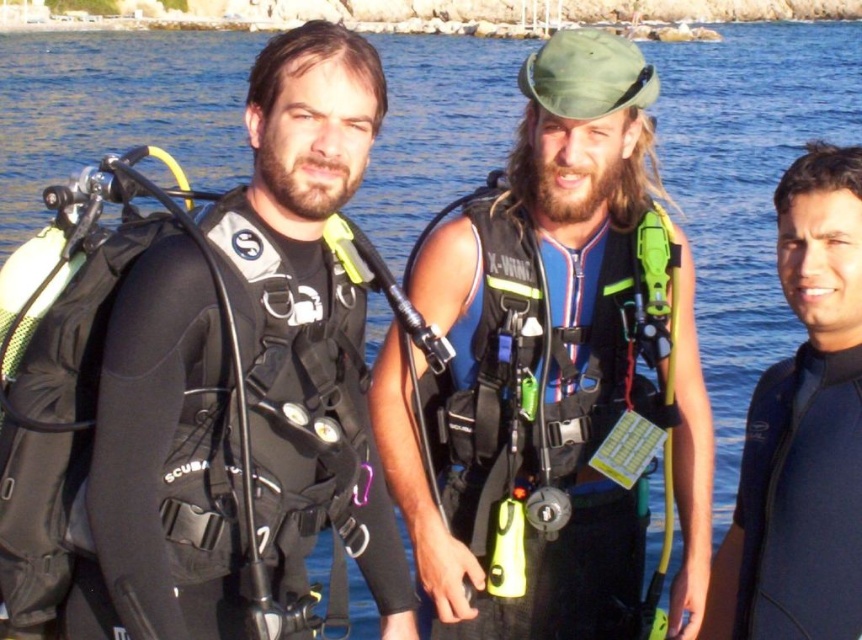
Who is positioned more to the right, matte black wetsuit at center or black matte wetsuit at left?

From the viewer's perspective, matte black wetsuit at center appears more on the right side.

Between matte black wetsuit at center and black matte wetsuit at left, which one has more height?

matte black wetsuit at center

Image resolution: width=862 pixels, height=640 pixels. What do you see at coordinates (551, 369) in the screenshot?
I see `matte black wetsuit at center` at bounding box center [551, 369].

Where is `matte black wetsuit at center`? This screenshot has width=862, height=640. matte black wetsuit at center is located at coordinates (551, 369).

Is point (292, 413) positioned before point (813, 292)?

Yes, it is.

Is black matte wetsuit at left thinner than black matte wetsuit at right?

No.

Measure the distance between point (364, 424) and camera.

They are 93.74 feet apart.

At what (x,y) coordinates should I click in order to perform the action: click on black matte wetsuit at left. Please return your answer as a coordinate pair (x, y). Looking at the image, I should click on (311, 289).

Is matte black wetsuit at center thinner than black matte wetsuit at right?

Incorrect, matte black wetsuit at center's width is not less than black matte wetsuit at right's.

Can you confirm if matte black wetsuit at center is shorter than black matte wetsuit at right?

No.

Locate an element on the screen. The height and width of the screenshot is (640, 862). matte black wetsuit at center is located at coordinates (551, 369).

This screenshot has height=640, width=862. Find the location of `matte black wetsuit at center`. matte black wetsuit at center is located at coordinates (551, 369).